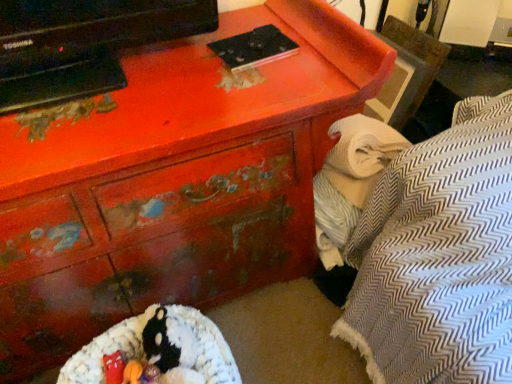
Question: From their relative heights in the image, would you say white textured blanket at right is taller or shorter than fluffy white bean bag at lower center?

Choices:
 (A) short
 (B) tall

Answer: (B)

Question: Based on their sizes in the image, would you say white textured blanket at right is bigger or smaller than fluffy white bean bag at lower center?

Choices:
 (A) small
 (B) big

Answer: (A)

Question: Looking at their shapes, would you say white textured blanket at right is wider or thinner than fluffy white bean bag at lower center?

Choices:
 (A) wide
 (B) thin

Answer: (B)

Question: Considering the positions of point (74, 362) and point (342, 119), is point (74, 362) closer or farther from the camera than point (342, 119)?

Choices:
 (A) closer
 (B) farther

Answer: (A)

Question: Is fluffy white bean bag at lower center wider or thinner than white textured blanket at right?

Choices:
 (A) wide
 (B) thin

Answer: (A)

Question: In the image, is fluffy white bean bag at lower center positioned in front of or behind white textured blanket at right?

Choices:
 (A) front
 (B) behind

Answer: (A)

Question: In the image, is fluffy white bean bag at lower center on the left side or the right side of white textured blanket at right?

Choices:
 (A) right
 (B) left

Answer: (B)